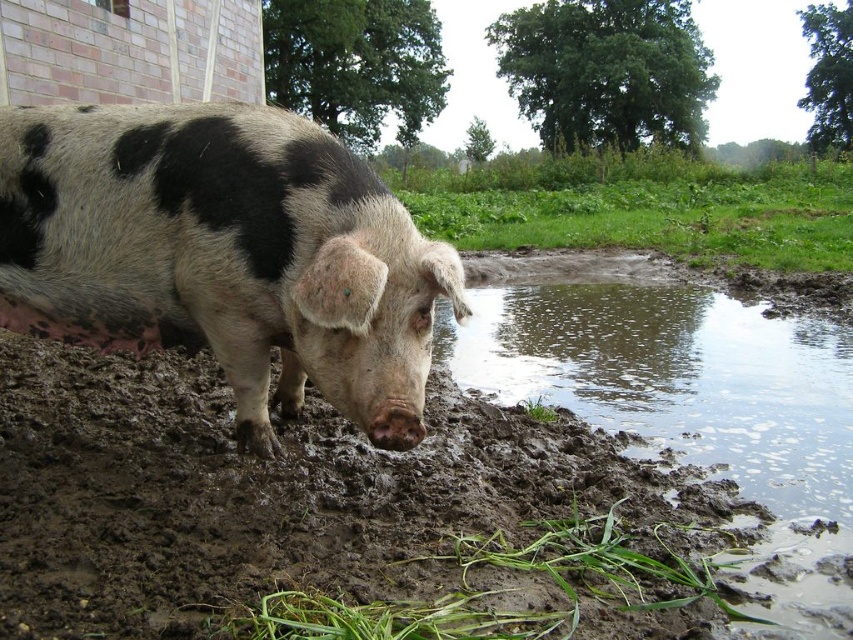
Is brown wet mud at lower center below green grassy mud at lower center?

No.

Consider the image. Can you confirm if brown wet mud at lower center is positioned to the left of green grassy mud at lower center?

Correct, you'll find brown wet mud at lower center to the left of green grassy mud at lower center.

Is point (91, 428) farther from viewer compared to point (486, 566)?

Yes, it is behind point (486, 566).

This screenshot has width=853, height=640. I want to click on brown wet mud at lower center, so click(x=332, y=516).

Consider the image. Can you confirm if speckled fur pig at lower left is shorter than muddy water at lower right?

Incorrect, speckled fur pig at lower left's height does not fall short of muddy water at lower right's.

Can you confirm if speckled fur pig at lower left is smaller than muddy water at lower right?

Correct, speckled fur pig at lower left occupies less space than muddy water at lower right.

This screenshot has width=853, height=640. I want to click on speckled fur pig at lower left, so click(223, 253).

In the scene shown: Is speckled fur pig at lower left behind green grass at center?

No, it is not.

Which is behind, point (39, 161) or point (514, 234)?

Positioned behind is point (514, 234).

The image size is (853, 640). I want to click on speckled fur pig at lower left, so click(x=223, y=253).